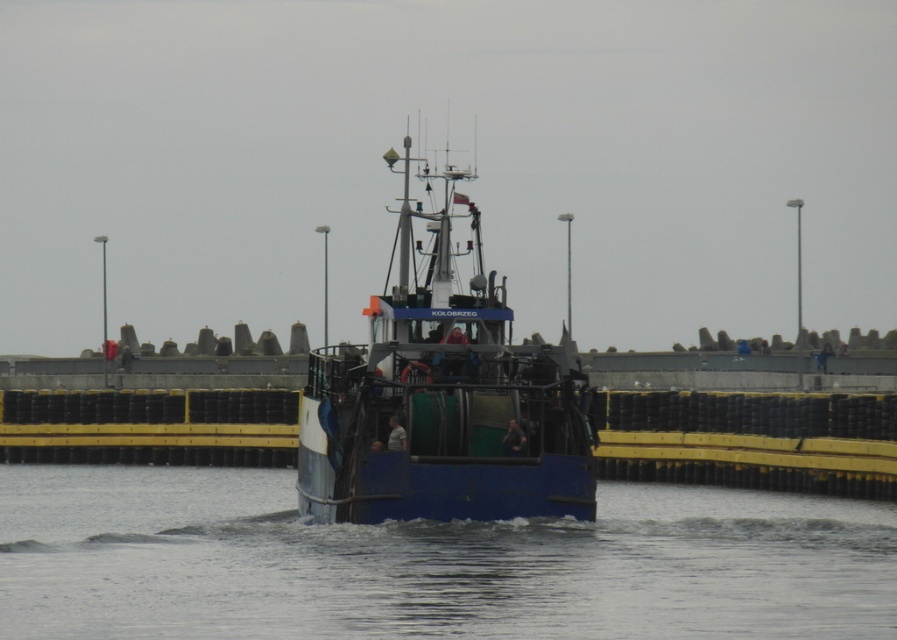
Question: Is the position of blue water at center less distant than that of blue matte boat at center?

Choices:
 (A) no
 (B) yes

Answer: (B)

Question: Can you confirm if blue water at center is positioned below blue matte boat at center?

Choices:
 (A) no
 (B) yes

Answer: (B)

Question: Is blue water at center in front of blue matte boat at center?

Choices:
 (A) no
 (B) yes

Answer: (B)

Question: Which of the following is the farthest from the observer?

Choices:
 (A) (460, 195)
 (B) (93, 538)

Answer: (B)

Question: Among these points, which one is farthest from the camera?

Choices:
 (A) (429, 284)
 (B) (868, 548)

Answer: (A)